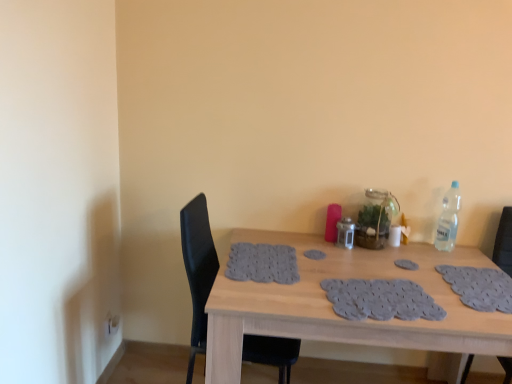
You are a GUI agent. You are given a task and a screenshot of the screen. Output one action in this format:
    pyautogui.click(x=<x>, y=<y>)
    Task: Click on the vacant space that is to the left of gray fabric footprint at center, marked as the 2th footprint in a right-to-left arrangement
    
    Given the screenshot: What is the action you would take?
    pyautogui.click(x=300, y=252)